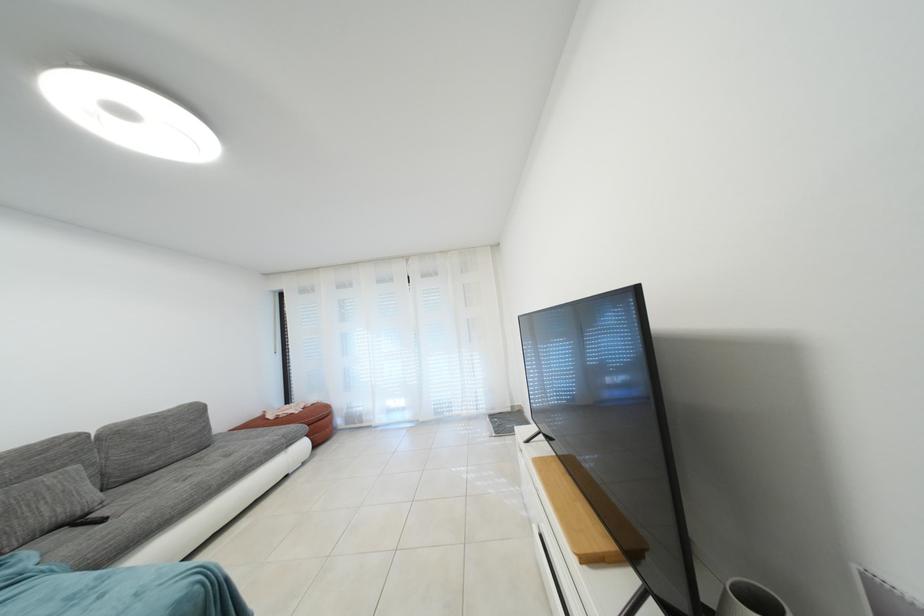
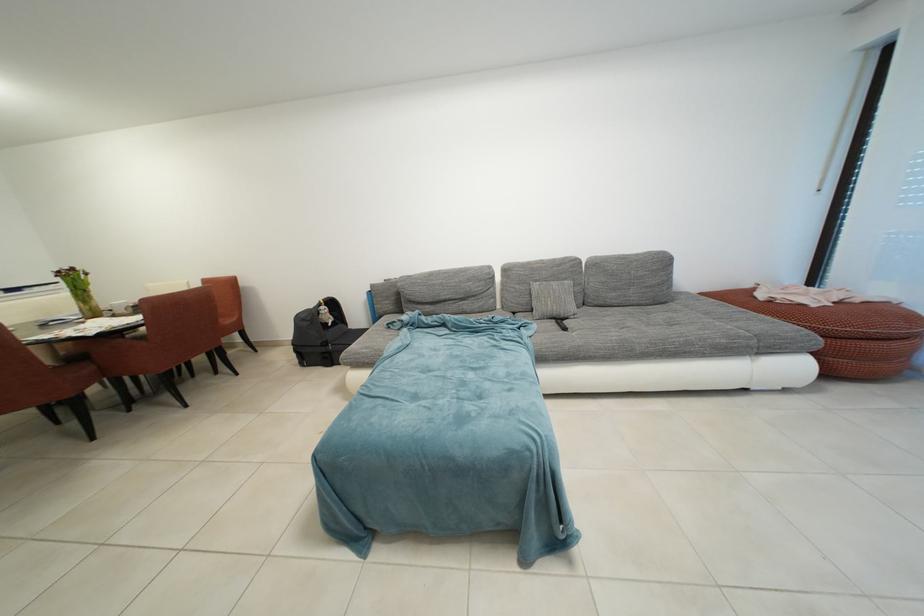
The point at (318, 408) is marked in the first image. Where is the corresponding point in the second image?

(865, 305)